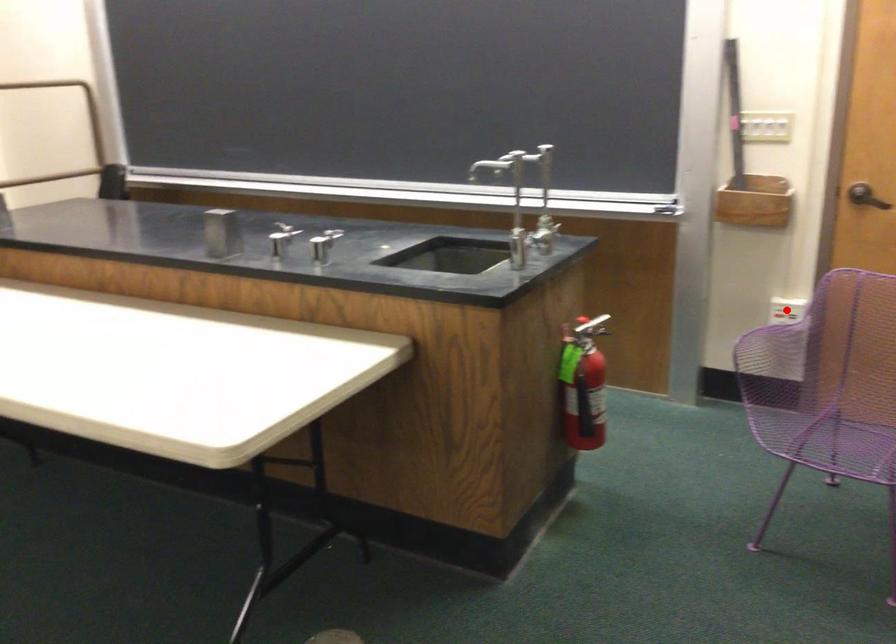
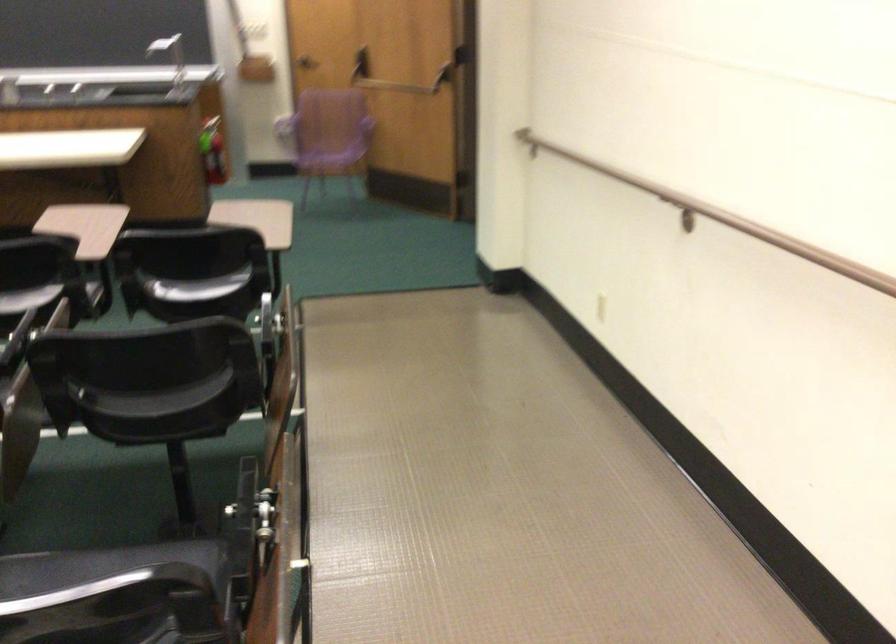
Question: I am providing you with two images of the same scene from different viewpoints. A red point is marked on the first image. Is the red point's position out of view in image 2?

Choices:
 (A) Yes
 (B) No

Answer: (A)